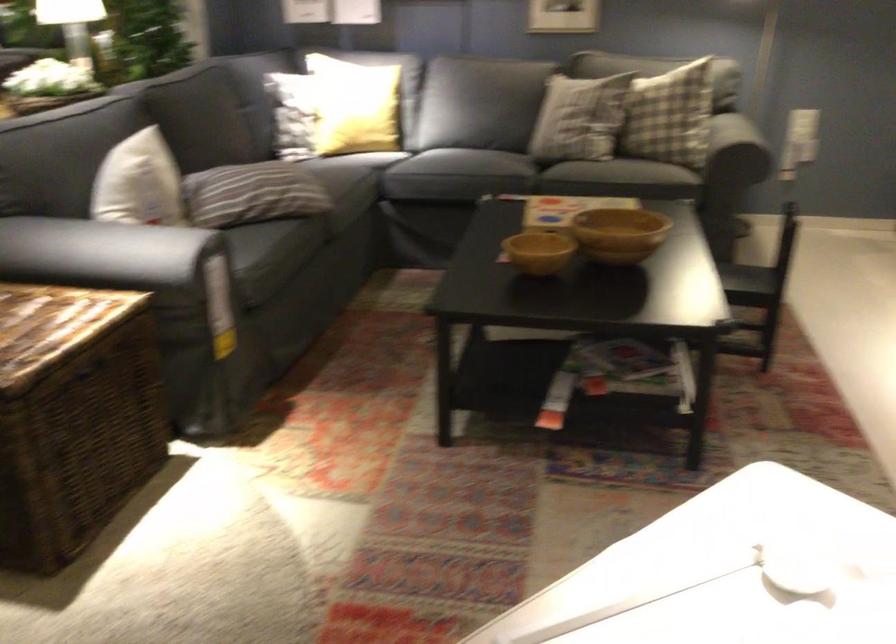
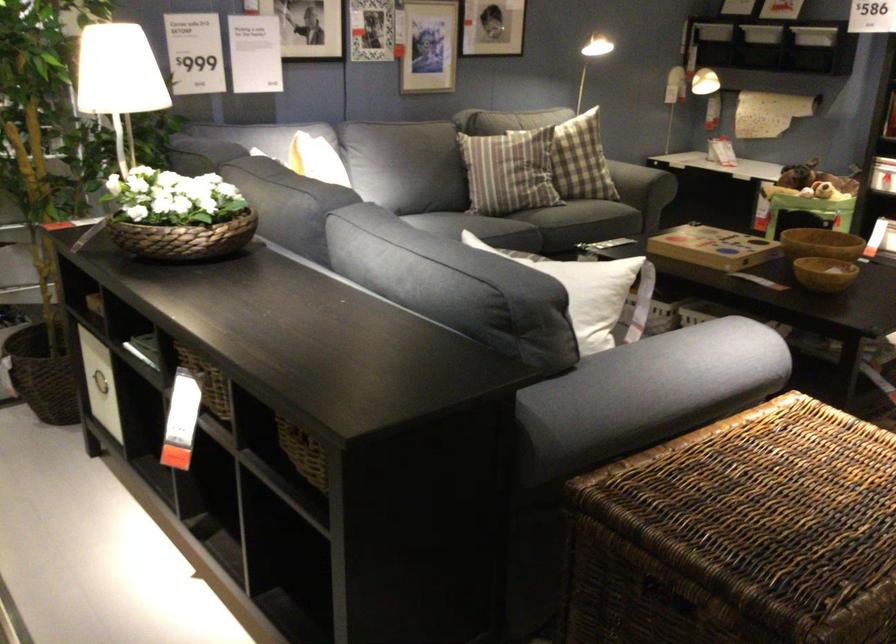
Question: I am providing you with two images of the same scene from different viewpoints. After the viewpoint changes to image2, which objects are now occluded?

Choices:
 (A) white storage bin
 (B) dark sofa armrest
 (C) sofa sitting surface
 (D) red electrical switch

Answer: (B)